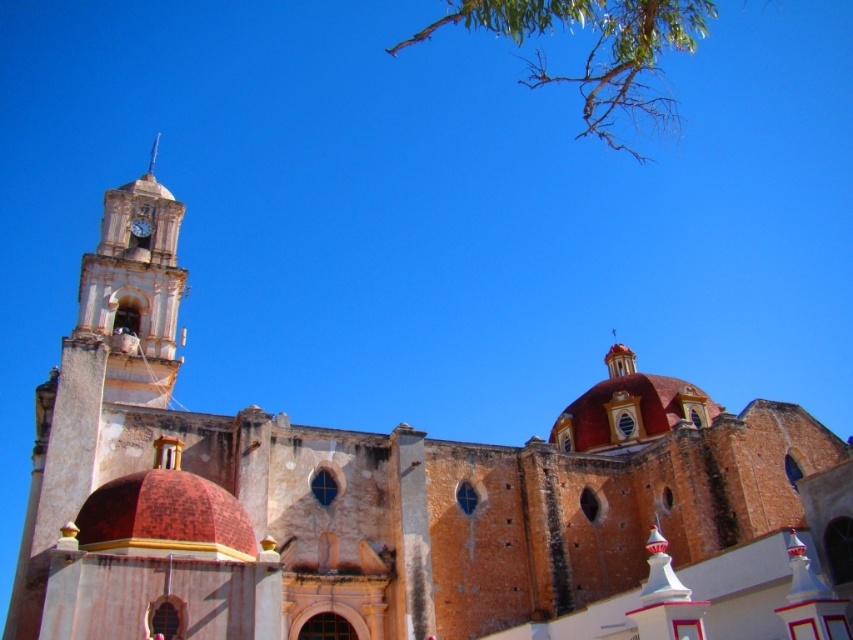
Question: Is white stone clock tower at upper left to the right of green leafy branches at upper center from the viewer's perspective?

Choices:
 (A) no
 (B) yes

Answer: (A)

Question: From the image, what is the correct spatial relationship of white stone clock tower at upper left in relation to metallic gold clock at upper left?

Choices:
 (A) right
 (B) left

Answer: (B)

Question: Can you confirm if white stone clock tower at upper left is positioned below green leafy branches at upper center?

Choices:
 (A) yes
 (B) no

Answer: (A)

Question: Which point is farther to the camera?

Choices:
 (A) (132, 227)
 (B) (132, 300)

Answer: (A)

Question: Among these objects, which one is farthest from the camera?

Choices:
 (A) white stone clock tower at upper left
 (B) green leafy branches at upper center
 (C) metallic gold clock at upper left

Answer: (C)

Question: Which point is farther from the camera taking this photo?

Choices:
 (A) (136, 227)
 (B) (541, 3)

Answer: (A)